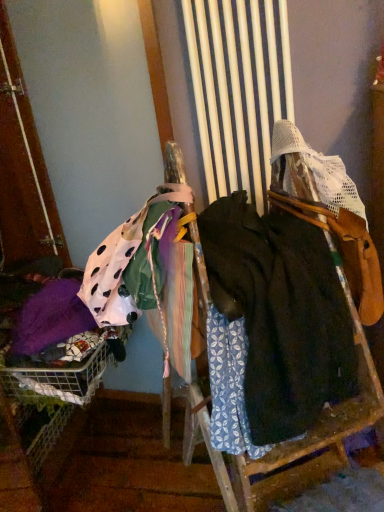
What do you see at coordinates (299, 441) in the screenshot? The image size is (384, 512). I see `dark green fabric at center` at bounding box center [299, 441].

At what (x,y) coordinates should I click in order to perform the action: click on dark green fabric at center. Please return your answer as a coordinate pair (x, y). The image size is (384, 512). Looking at the image, I should click on (299, 441).

Find the location of a particular element. dark green fabric at center is located at coordinates (299, 441).